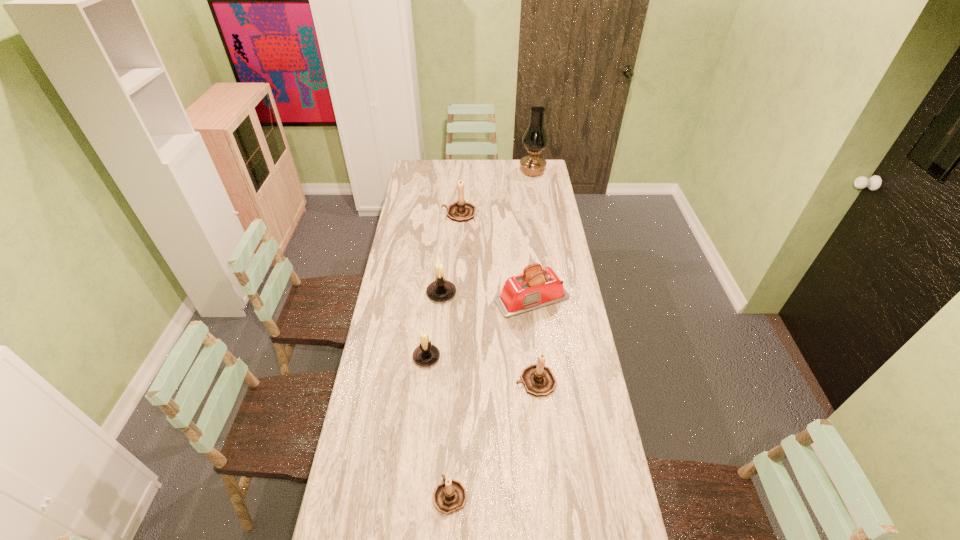
Locate an element on the screen. oil lamp present at the right edge is located at coordinates (535, 139).

Find the location of `toaster that is at the right edge`. toaster that is at the right edge is located at coordinates (537, 287).

Find the location of a particular element. candle holder positioned at the right edge is located at coordinates (538, 380).

You are a GUI agent. You are given a task and a screenshot of the screen. Output one action in this format:
    pyautogui.click(x=<x>, y=<y>)
    Task: Click on the object present at the far right corner
    The image size is (960, 540).
    Given the screenshot: What is the action you would take?
    pyautogui.click(x=535, y=139)

Find the location of a particular element. vacant position at the left edge of the desktop is located at coordinates (384, 358).

Find the location of a particular element. This screenshot has height=540, width=960. free space at the right edge of the desktop is located at coordinates (539, 191).

The height and width of the screenshot is (540, 960). What are the coordinates of `vacant space at the far left corner of the desktop` in the screenshot? It's located at (432, 174).

The image size is (960, 540). Find the location of `vacant area that lies between the second farthest object and the nearest brown candle holder`. vacant area that lies between the second farthest object and the nearest brown candle holder is located at coordinates (454, 354).

You are a GUI agent. You are given a task and a screenshot of the screen. Output one action in this format:
    pyautogui.click(x=<x>, y=<y>)
    Task: Click on the free space between the red toaster and the bigger white candle holder
    The image size is (960, 540).
    Given the screenshot: What is the action you would take?
    pyautogui.click(x=487, y=296)

Locate an element on the screen. The height and width of the screenshot is (540, 960). empty space that is in between the nearer white candle holder and the farther white candle holder is located at coordinates (434, 325).